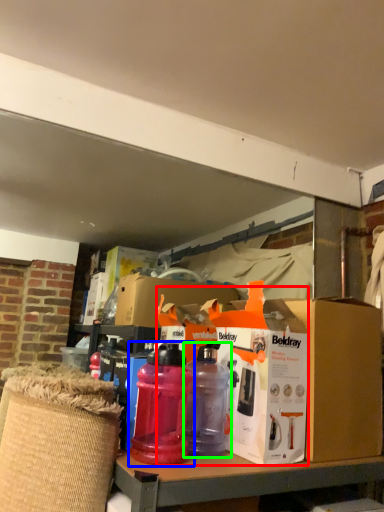
Question: Estimate the real-world distances between objects in this image. Which object is closer to box (highlighted by a red box), bottle (highlighted by a blue box) or bottle (highlighted by a green box)?

Choices:
 (A) bottle
 (B) bottle

Answer: (B)